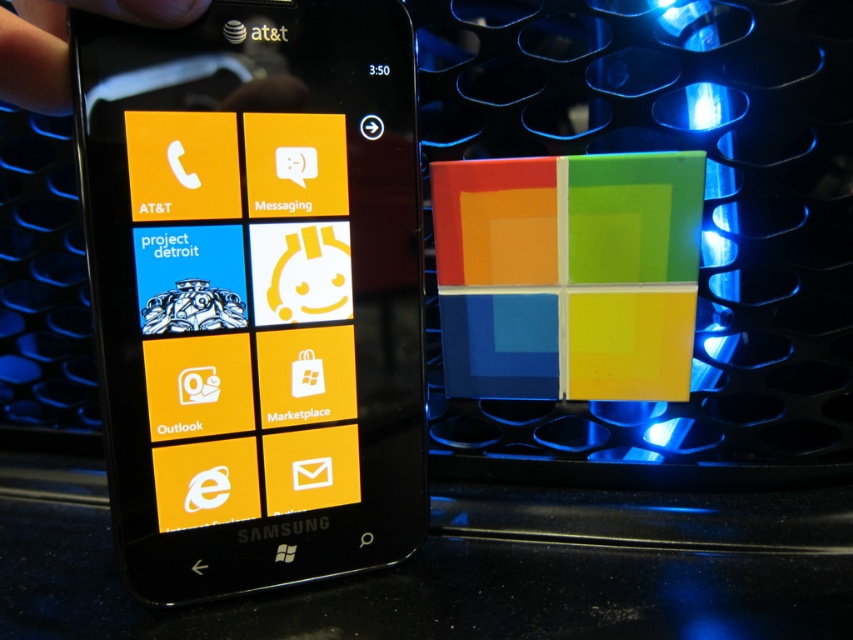
Question: Which object appears farthest from the camera in this image?

Choices:
 (A) black matte hand at upper left
 (B) black glossy smartphone at left

Answer: (B)

Question: Can you confirm if black glossy smartphone at left is positioned to the left of black matte hand at upper left?

Choices:
 (A) no
 (B) yes

Answer: (A)

Question: Considering the relative positions of black glossy smartphone at left and black matte hand at upper left in the image provided, where is black glossy smartphone at left located with respect to black matte hand at upper left?

Choices:
 (A) right
 (B) left

Answer: (A)

Question: Can you confirm if black glossy smartphone at left is wider than black matte hand at upper left?

Choices:
 (A) no
 (B) yes

Answer: (B)

Question: Which point is farther to the camera?

Choices:
 (A) black matte hand at upper left
 (B) black glossy smartphone at left

Answer: (B)